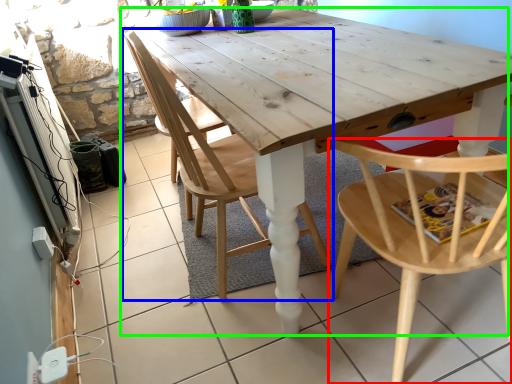
Question: Estimate the real-world distances between objects in this image. Which object is farther from chair (highlighted by a red box), chair (highlighted by a blue box) or table (highlighted by a green box)?

Choices:
 (A) chair
 (B) table

Answer: (A)